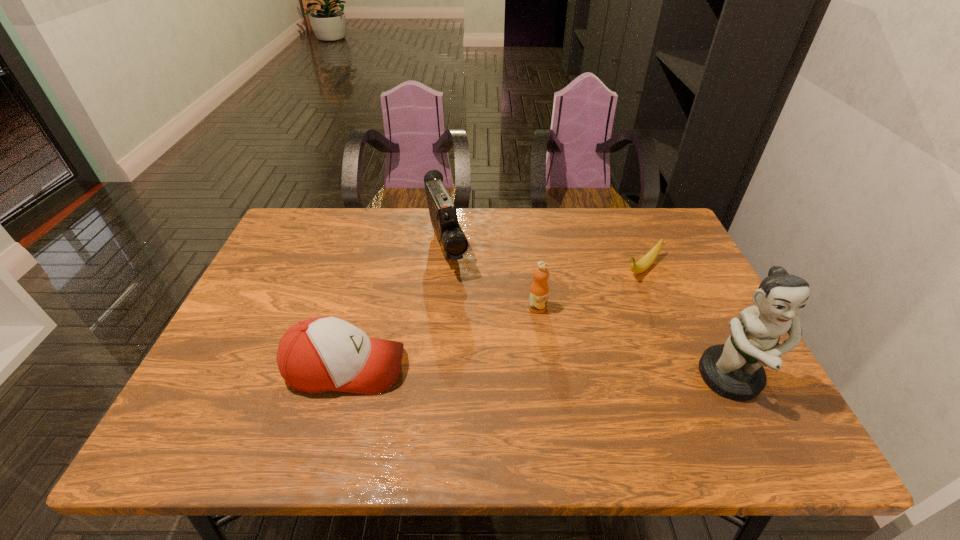
Where is `vacant space situated on the front-facing side of the camcorder`? The image size is (960, 540). vacant space situated on the front-facing side of the camcorder is located at coordinates (467, 317).

Image resolution: width=960 pixels, height=540 pixels. Find the location of `free space located on the front label of the third object from left to right`. free space located on the front label of the third object from left to right is located at coordinates (553, 327).

At what (x,y) coordinates should I click in order to perform the action: click on vacant region located 0.120m on the front label of the third object from left to right. Please return your answer as a coordinate pair (x, y). The width and height of the screenshot is (960, 540). Looking at the image, I should click on click(x=568, y=347).

Find the location of `vacant area situated 0.270m on the front label of the third object from left to right`. vacant area situated 0.270m on the front label of the third object from left to right is located at coordinates (608, 397).

Image resolution: width=960 pixels, height=540 pixels. I want to click on vacant region located 0.380m at the stem of the banana, so pyautogui.click(x=543, y=359).

Identify the location of vacant space located 0.100m at the stem of the banana. The height and width of the screenshot is (540, 960). (610, 298).

Where is `vacant position located at the stem of the banana`? The width and height of the screenshot is (960, 540). vacant position located at the stem of the banana is located at coordinates (578, 326).

Identify the location of camcorder that is at the far edge. The image size is (960, 540). (453, 242).

Identify the location of banana that is at the far edge. This screenshot has height=540, width=960. (646, 261).

The image size is (960, 540). I want to click on baseball cap present at the near edge, so click(x=321, y=354).